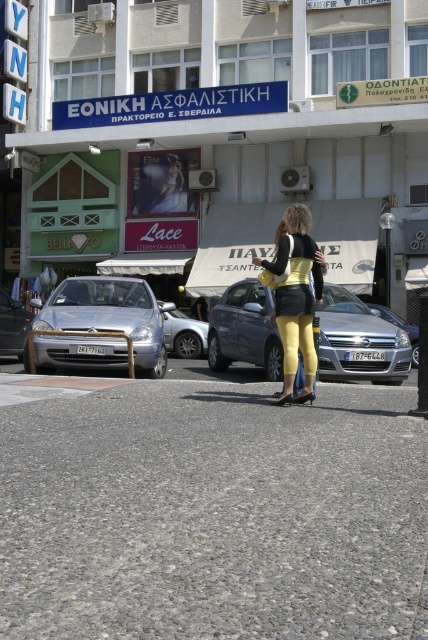
Question: Which point is farther to the camera?

Choices:
 (A) (369, 310)
 (B) (321, 272)
 (C) (184, 340)
 (D) (26, 330)

Answer: (C)

Question: Can you confirm if silver metallic car at center is bigger than satin silver sedan at center?

Choices:
 (A) no
 (B) yes

Answer: (A)

Question: Which is nearer to the silver metallic sedan at left?

Choices:
 (A) yellow matte leggings at center
 (B) silver metallic car at center
 (C) satin silver car at left
 (D) metallic gray sedan at center

Answer: (C)

Question: Considering the real-world distances, which object is farthest from the satin silver sedan at center?

Choices:
 (A) silver metallic car at center
 (B) satin silver car at left

Answer: (B)

Question: Is satin silver car at left below satin silver sedan at center?

Choices:
 (A) yes
 (B) no

Answer: (B)

Question: Can you confirm if metallic gray sedan at center is thinner than satin silver sedan at center?

Choices:
 (A) yes
 (B) no

Answer: (A)